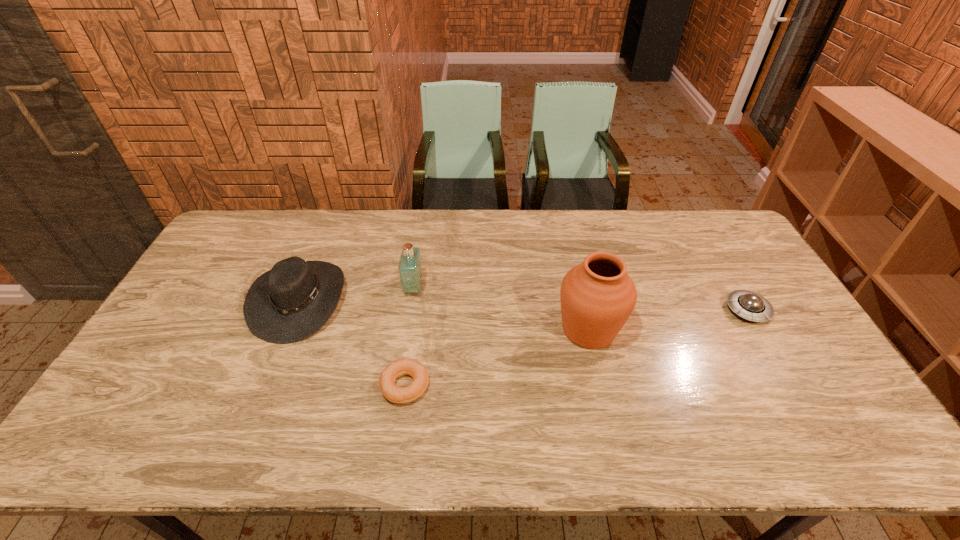
At what (x,y) coordinates should I click in order to perform the action: click on object that stands as the fourth closest to the rightmost object. Please return your answer as a coordinate pair (x, y). The width and height of the screenshot is (960, 540). Looking at the image, I should click on pos(289,303).

The height and width of the screenshot is (540, 960). I want to click on blank area in the image that satisfies the following two spatial constraints: 1. on the front-facing side of the cowboy hat; 2. on the right side of the shortest object, so click(x=265, y=386).

The image size is (960, 540). I want to click on vacant space that satisfies the following two spatial constraints: 1. on the front label of the shortest object; 2. on the left side of the fourth shortest object, so click(398, 386).

You are a GUI agent. You are given a task and a screenshot of the screen. Output one action in this format:
    pyautogui.click(x=<x>, y=<y>)
    Task: Click on the blank area in the image that satisfies the following two spatial constraints: 1. on the front-facing side of the third shortest object; 2. on the left side of the urn
    
    Given the screenshot: What is the action you would take?
    click(x=288, y=329)

I want to click on vacant space that satisfies the following two spatial constraints: 1. on the front-facing side of the tallest object; 2. on the right side of the cowboy hat, so click(x=288, y=329).

I want to click on free spot that satisfies the following two spatial constraints: 1. on the front-facing side of the shortest object; 2. on the left side of the cowboy hat, so click(265, 386).

At what (x,y) coordinates should I click in order to perform the action: click on vacant point that satisfies the following two spatial constraints: 1. on the front label of the nearest object; 2. on the right side of the perfume. Please return your answer as a coordinate pair (x, y). This screenshot has width=960, height=540. Looking at the image, I should click on (398, 386).

Locate an element on the screen. The height and width of the screenshot is (540, 960). blank space that satisfies the following two spatial constraints: 1. on the back side of the bagel; 2. on the front label of the fourth shortest object is located at coordinates (419, 288).

The width and height of the screenshot is (960, 540). What are the coordinates of `free space that satisfies the following two spatial constraints: 1. on the front-facing side of the bagel; 2. on the left side of the leftmost object` in the screenshot? It's located at (265, 386).

At what (x,y) coordinates should I click in order to perform the action: click on vacant space that satisfies the following two spatial constraints: 1. on the front label of the perfume; 2. on the back side of the nearest object. Please return your answer as a coordinate pair (x, y). Looking at the image, I should click on (398, 386).